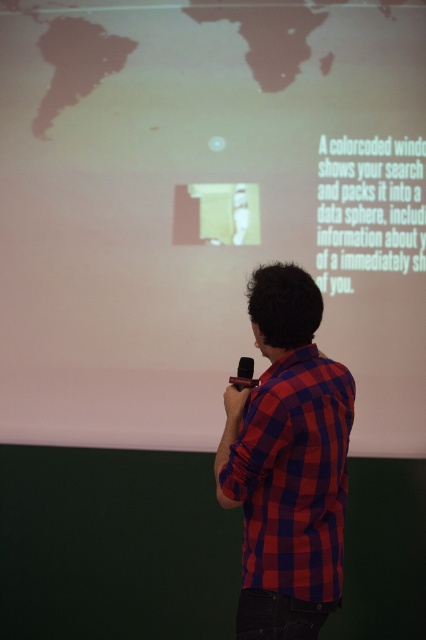
Looking at this image, you are an attendee at a presentation and want to take a photo of the white matte projection screen at upper center and the red checkered shirt at center. Which object should you focus on first if you want to capture both clearly in the same frame?

The white matte projection screen at upper center is bigger than the red checkered shirt at center, so you should focus on the white matte projection screen at upper center first to ensure it is in focus, then adjust for the smaller red checkered shirt at center.

You are an AI assistant. You see a point at coordinates (206,208) on the white matte projection screen at upper center. What is the purpose of this point in the context of the presentation slide shown?

The point at coordinates (206,208) on the white matte projection screen at upper center is part of the graphic resembling a map or globe with a green highlighted area and a figure walking or running within it. The graphic illustrates how a color coded window organizes search data into a data sphere, including user information.